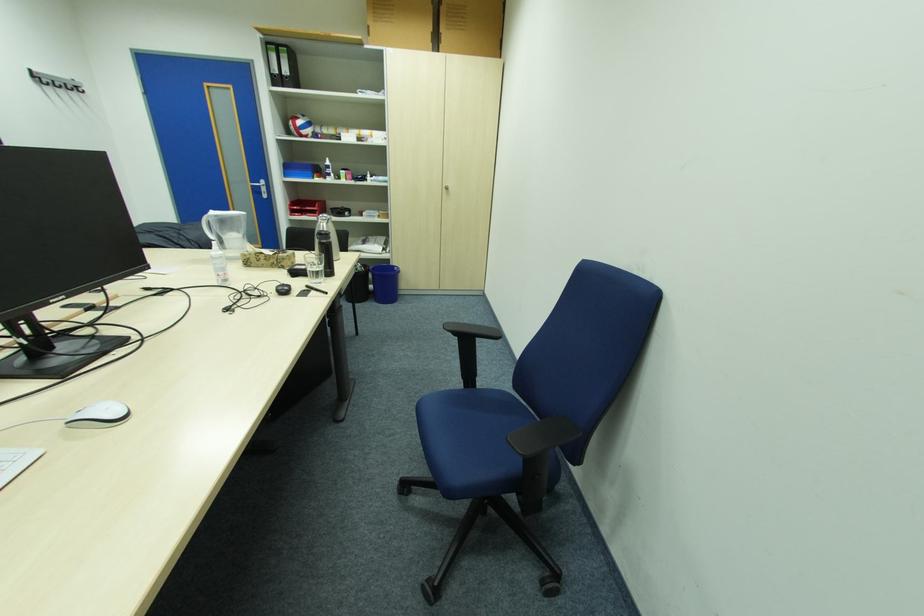
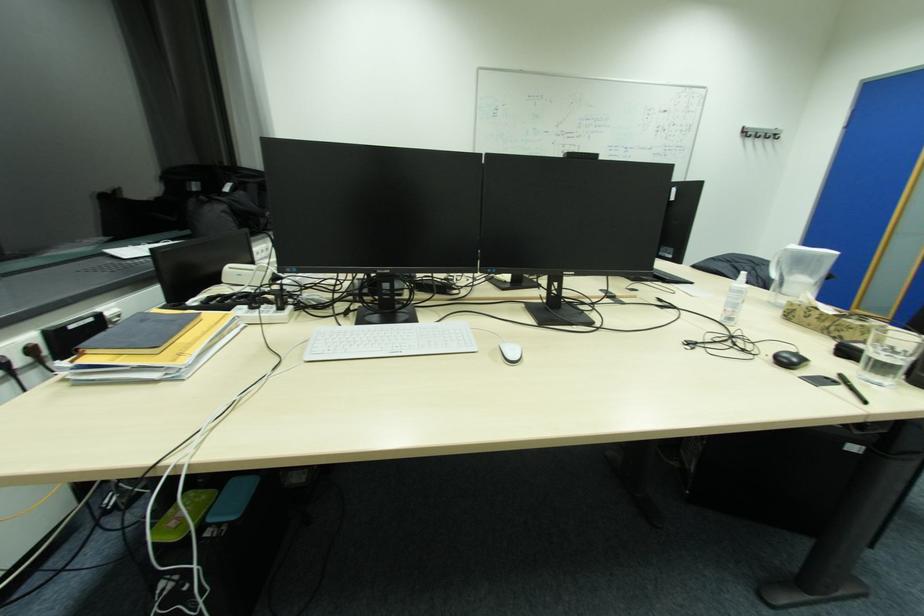
Question: Based on the continuous images, in which direction is the camera rotating? Reply with the corresponding letter.

Choices:
 (A) Left
 (B) Right
 (C) Up
 (D) Down

Answer: (A)